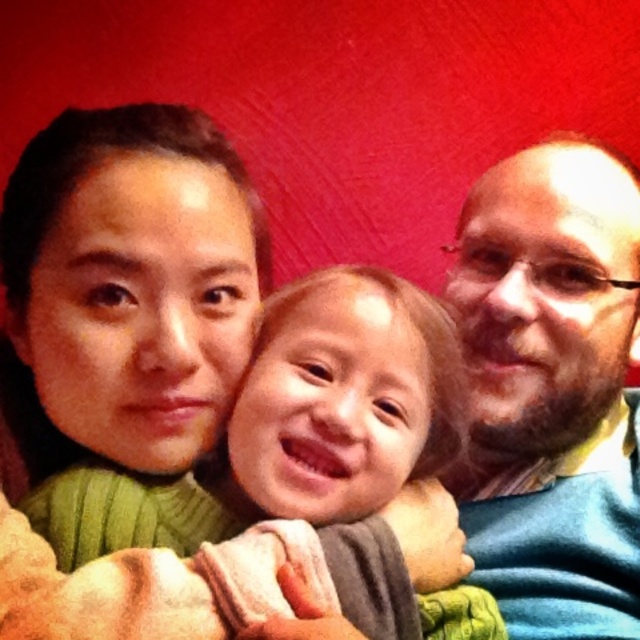
Question: Which point is closer to the camera taking this photo?

Choices:
 (A) (144, 621)
 (B) (573, 260)

Answer: (A)

Question: Which point appears farthest from the camera in this image?

Choices:
 (A) (497, 260)
 (B) (300, 568)

Answer: (A)

Question: Can you confirm if blue sweater at right is positioned to the right of smooth beige blanket at center?

Choices:
 (A) yes
 (B) no

Answer: (A)

Question: Can you confirm if blue sweater at right is positioned above smooth beige blanket at center?

Choices:
 (A) no
 (B) yes

Answer: (B)

Question: Which of the following is the closest to the observer?

Choices:
 (A) (477, 266)
 (B) (26, 586)

Answer: (B)

Question: Does blue sweater at right have a larger size compared to smooth beige blanket at center?

Choices:
 (A) no
 (B) yes

Answer: (B)